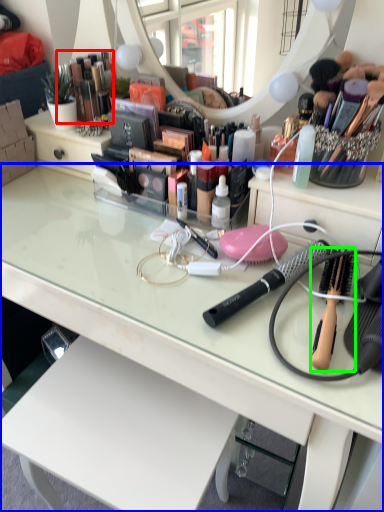
Question: Estimate the real-world distances between objects in this image. Which object is closer to toiletry (highlighted by a red box), desk (highlighted by a blue box) or brush (highlighted by a green box)?

Choices:
 (A) desk
 (B) brush

Answer: (A)